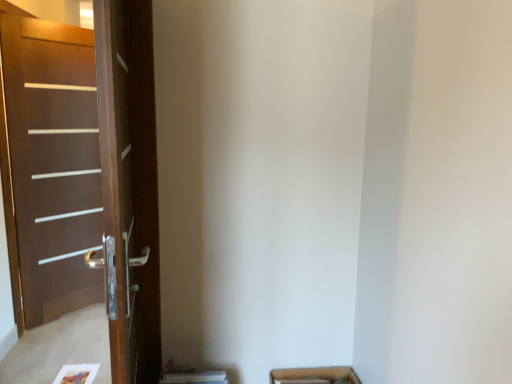
Question: Considering the positions of brown wooden screen door at left and brown wood door at left in the image, is brown wooden screen door at left taller or shorter than brown wood door at left?

Choices:
 (A) tall
 (B) short

Answer: (B)

Question: Does point (118, 140) appear closer or farther from the camera than point (120, 218)?

Choices:
 (A) farther
 (B) closer

Answer: (A)

Question: From the image's perspective, relative to brown wood door at left, is brown wooden screen door at left above or below?

Choices:
 (A) below
 (B) above

Answer: (A)

Question: Does point (151, 152) appear closer or farther from the camera than point (124, 24)?

Choices:
 (A) farther
 (B) closer

Answer: (A)

Question: Is brown wood door at left in front of or behind brown wooden screen door at left in the image?

Choices:
 (A) behind
 (B) front

Answer: (A)

Question: Considering the positions of brown wood door at left and brown wooden screen door at left in the image, is brown wood door at left wider or thinner than brown wooden screen door at left?

Choices:
 (A) thin
 (B) wide

Answer: (A)

Question: Based on their sizes in the image, would you say brown wood door at left is bigger or smaller than brown wooden screen door at left?

Choices:
 (A) small
 (B) big

Answer: (A)